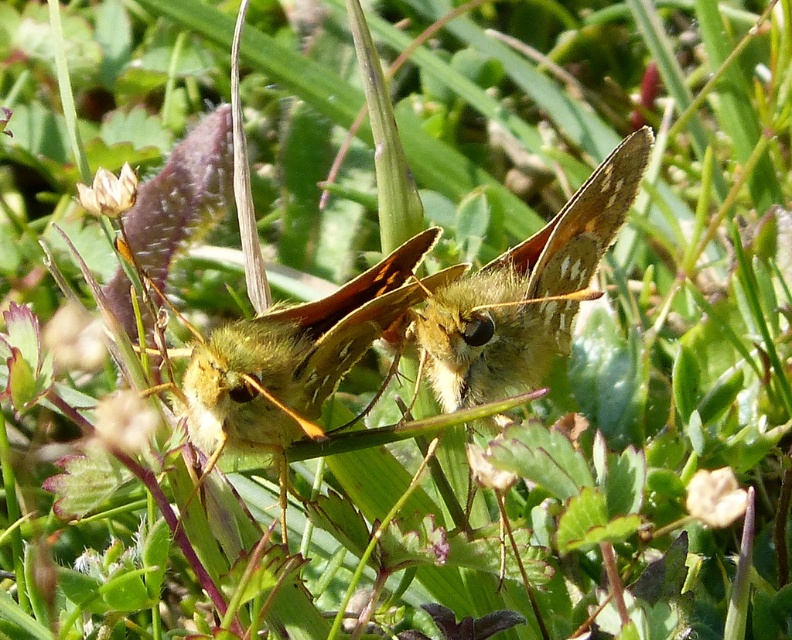
You are an entomologist observing two butterflies on a leaf. You have a net that can only catch butterflies wider than 5 cm. The fuzzy yellow butterfly at center and the green fuzzy butterfly at center are both in your sight. Can your net catch both?

The fuzzy yellow butterfly at center is larger in width than the green fuzzy butterfly at center. Since the net can only catch butterflies wider than 5 cm, you need to check if the fuzzy yellow butterfly at center is wider than 5 cm. If it is, then the green fuzzy butterfly at center might be smaller and not catchable. However, without specific measurements, we can only confirm the relative size between them.

You are a nature photographer aiming to capture the tallest butterfly in the image. Given that you see a fuzzy yellow butterfly at center and a green fuzzy butterfly at center, which one should you focus on?

The fuzzy yellow butterfly at center is taller than the green fuzzy butterfly at center, so you should focus on the fuzzy yellow butterfly at center to capture the tallest one.

Consider the image. You are a researcher studying butterfly behavior. You observe a fuzzy yellow butterfly at center in a dense green environment. Based on its position, can you determine if it is closer to the top or bottom edge of the image?

The 2D location of fuzzy yellow butterfly at center is at point (520, 294). Since the y coordinate is 0.659, which is closer to 1.0, the top edge of the image, the fuzzy yellow butterfly at center is closer to the top edge.